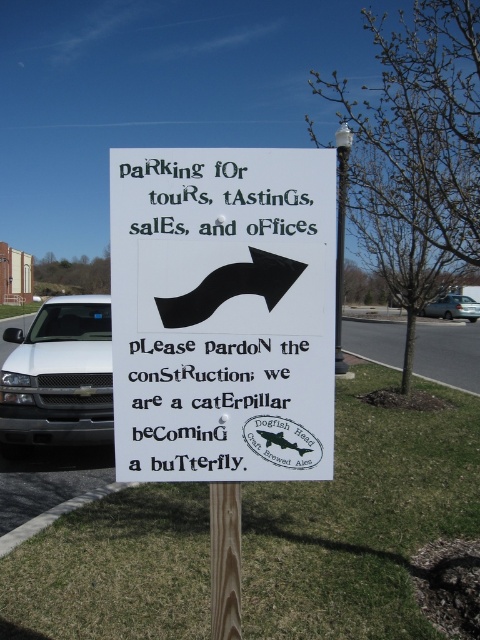
Question: Which is farther from the white matte truck at left?

Choices:
 (A) silver metallic sedan at right
 (B) black text at upper center
 (C) wooden post at center
 (D) black paper sign at center

Answer: (A)

Question: Can you confirm if black text at upper center is positioned to the right of black paper sign at center?

Choices:
 (A) yes
 (B) no

Answer: (A)

Question: Estimate the real-world distances between objects in this image. Which object is farther from the silver metallic sedan at right?

Choices:
 (A) white matte truck at left
 (B) wooden post at center

Answer: (B)

Question: Which object is the closest to the white paper sign at center?

Choices:
 (A) black text at upper center
 (B) silver metallic sedan at right

Answer: (A)

Question: Considering the relative positions of white matte truck at left and black text at upper center in the image provided, where is white matte truck at left located with respect to black text at upper center?

Choices:
 (A) below
 (B) above

Answer: (A)

Question: From the image, what is the correct spatial relationship of white matte truck at left in relation to black text at upper center?

Choices:
 (A) above
 (B) below

Answer: (B)